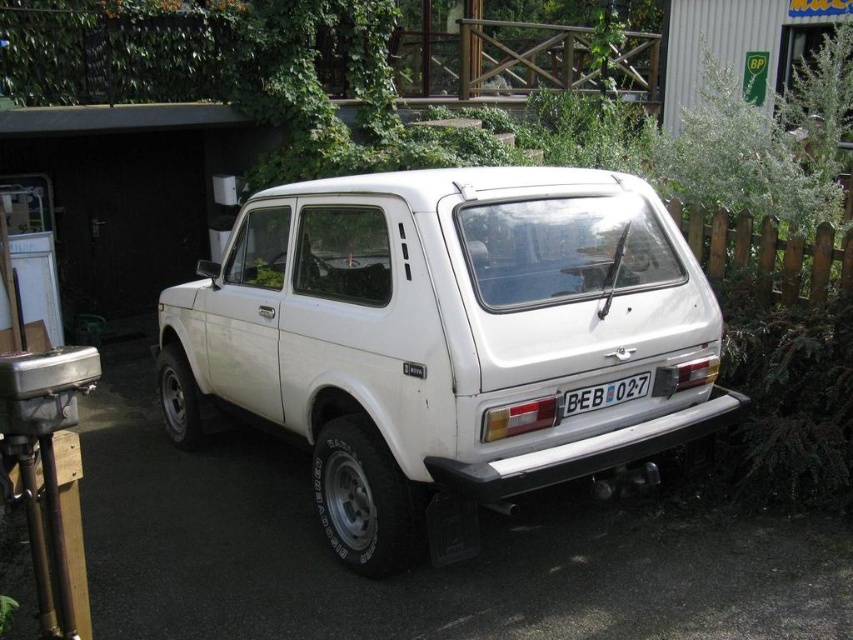
Can you confirm if white matte suv at center is shorter than white plastic license plate at rear?

No.

Is white matte suv at center bigger than white plastic license plate at rear?

Indeed, white matte suv at center has a larger size compared to white plastic license plate at rear.

Describe the element at coordinates (445, 340) in the screenshot. The image size is (853, 640). I see `white matte suv at center` at that location.

In order to click on white matte suv at center in this screenshot , I will do `click(445, 340)`.